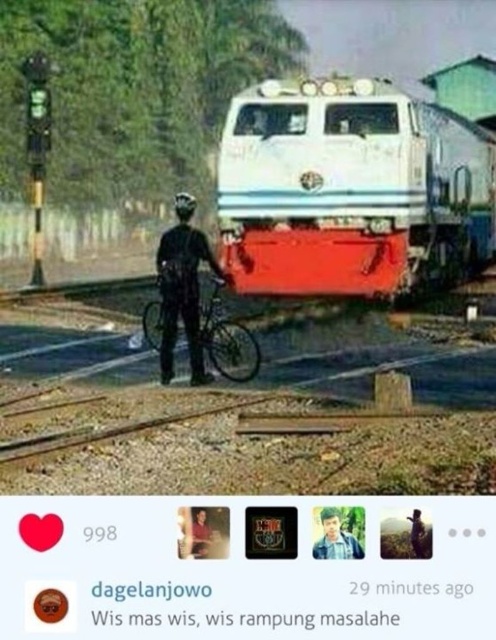
Question: Observing the image, what is the correct spatial positioning of white glossy train at center in reference to blue shirt at center?

Choices:
 (A) below
 (B) above

Answer: (B)

Question: Estimate the real-world distances between objects in this image. Which object is farther from the white glossy train at center?

Choices:
 (A) black matte bicycle at center
 (B) blue shirt at center

Answer: (B)

Question: Can you confirm if white glossy train at center is smaller than black matte bicycle at center?

Choices:
 (A) no
 (B) yes

Answer: (B)

Question: Which point is farther to the camera?

Choices:
 (A) tap(321, 522)
 (B) tap(345, 294)
 (C) tap(175, 253)

Answer: (B)

Question: Which of these objects is positioned closest to the blue shirt at center?

Choices:
 (A) black matte bicycle at center
 (B) white glossy train at center

Answer: (A)

Question: Where is white glossy train at center located in relation to black matte bicycle at center in the image?

Choices:
 (A) right
 (B) left

Answer: (A)